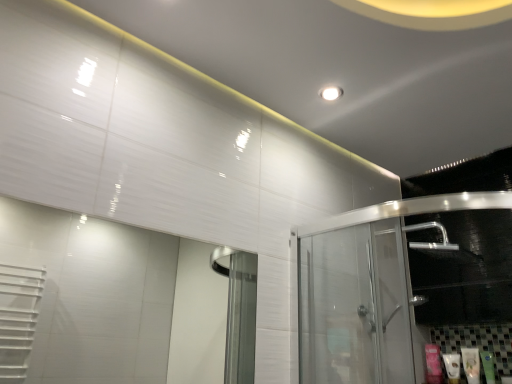
Question: Does white glossy lotion at lower right, marked as the third toiletry in a right-to-left arrangement, have a greater height compared to transparent glass door at right?

Choices:
 (A) yes
 (B) no

Answer: (B)

Question: Is white glossy lotion at lower right, marked as the third toiletry in a right-to-left arrangement, looking in the opposite direction of transparent glass door at right?

Choices:
 (A) no
 (B) yes

Answer: (A)

Question: From the image's perspective, is white glossy lotion at lower right, which ranks as the 2th toiletry in left-to-right order, under transparent glass door at right?

Choices:
 (A) no
 (B) yes

Answer: (B)

Question: Considering the relative sizes of white glossy lotion at lower right, marked as the third toiletry in a right-to-left arrangement, and transparent glass door at right in the image provided, is white glossy lotion at lower right, marked as the third toiletry in a right-to-left arrangement, shorter than transparent glass door at right?

Choices:
 (A) yes
 (B) no

Answer: (A)

Question: Considering the relative sizes of white glossy lotion at lower right, marked as the third toiletry in a right-to-left arrangement, and transparent glass door at right in the image provided, is white glossy lotion at lower right, marked as the third toiletry in a right-to-left arrangement, smaller than transparent glass door at right?

Choices:
 (A) no
 (B) yes

Answer: (B)

Question: Is transparent glass door at right bigger or smaller than white glossy lotion at lower right, which ranks as the 2th toiletry in right-to-left order?

Choices:
 (A) big
 (B) small

Answer: (A)

Question: Considering the positions of point (352, 286) and point (463, 370), is point (352, 286) closer or farther from the camera than point (463, 370)?

Choices:
 (A) farther
 (B) closer

Answer: (B)

Question: Looking at their shapes, would you say transparent glass door at right is wider or thinner than white glossy lotion at lower right, which ranks as the 2th toiletry in right-to-left order?

Choices:
 (A) wide
 (B) thin

Answer: (A)

Question: Considering their positions, is transparent glass door at right located in front of or behind white glossy lotion at lower right, which is counted as the third toiletry, starting from the left?

Choices:
 (A) front
 (B) behind

Answer: (A)

Question: Would you say green matte tube at lower right, which ranks as the 4th toiletry in left-to-right order, is to the left or to the right of pink matte tube at lower right, the fourth toiletry viewed from the right, in the picture?

Choices:
 (A) right
 (B) left

Answer: (A)

Question: Is point (488, 357) closer or farther from the camera than point (426, 367)?

Choices:
 (A) farther
 (B) closer

Answer: (B)

Question: From the image's perspective, is green matte tube at lower right, acting as the first toiletry starting from the right, above or below pink matte tube at lower right, the fourth toiletry viewed from the right?

Choices:
 (A) above
 (B) below

Answer: (A)

Question: Is green matte tube at lower right, acting as the first toiletry starting from the right, wider or thinner than pink matte tube at lower right, acting as the first toiletry starting from the left?

Choices:
 (A) wide
 (B) thin

Answer: (A)

Question: Is pink matte tube at lower right, acting as the first toiletry starting from the left, taller or shorter than white glossy lotion at lower right, marked as the third toiletry in a right-to-left arrangement?

Choices:
 (A) short
 (B) tall

Answer: (B)

Question: Relative to white glossy lotion at lower right, marked as the third toiletry in a right-to-left arrangement, is pink matte tube at lower right, acting as the first toiletry starting from the left, in front or behind?

Choices:
 (A) behind
 (B) front

Answer: (A)